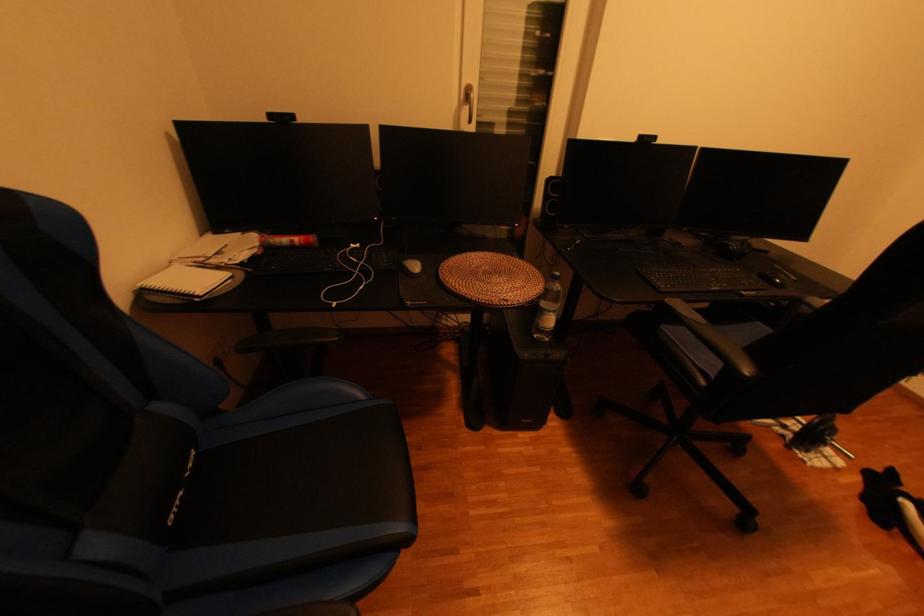
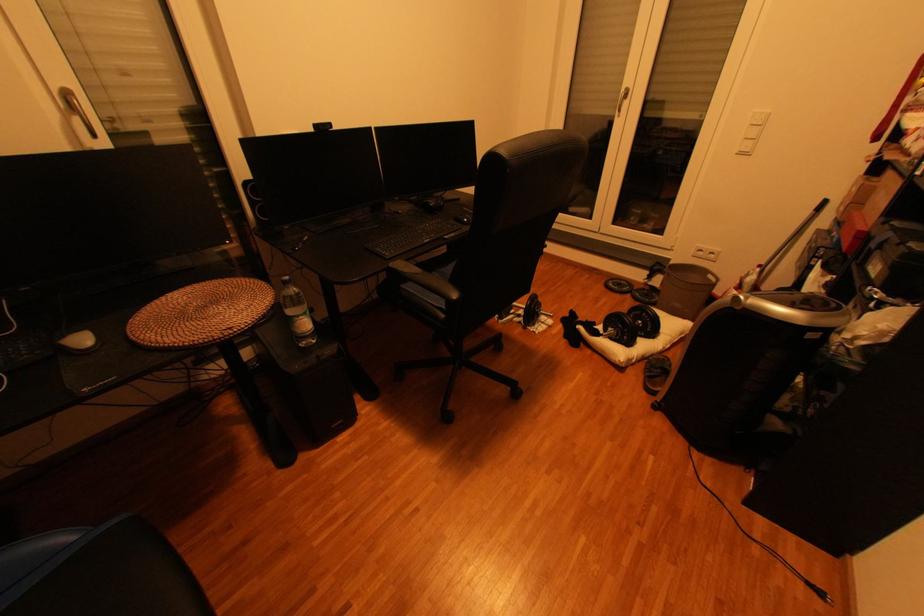
Find the pixel in the second image that matches pixel 424 267 in the first image.

(92, 341)